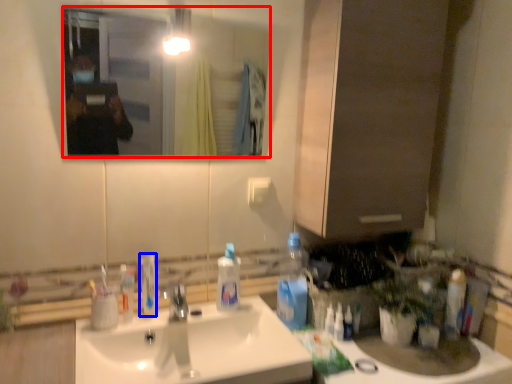
Question: Which object is further to the camera taking this photo, mirror (highlighted by a red box) or toothpaste (highlighted by a blue box)?

Choices:
 (A) mirror
 (B) toothpaste

Answer: (B)